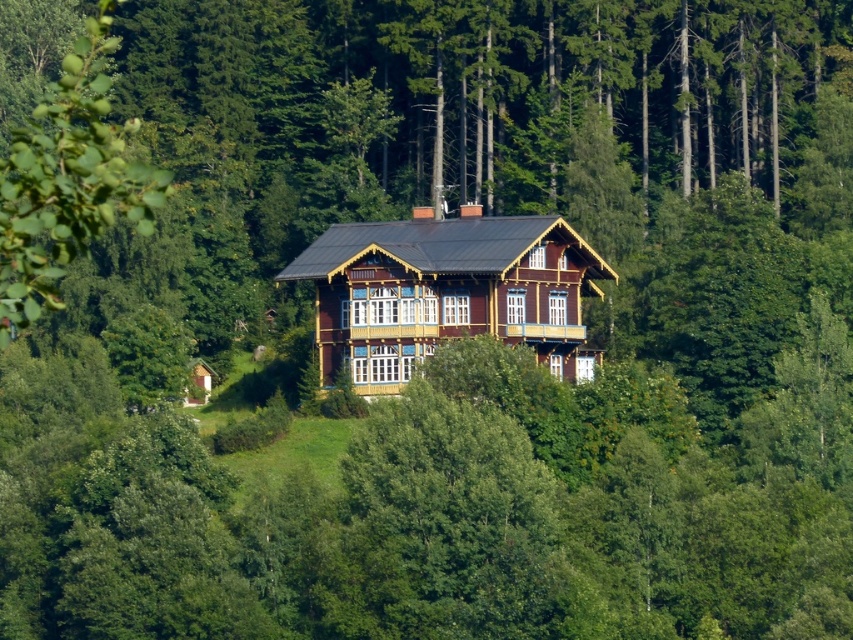
Which is more to the right, wooden cabin at center or green leafy tree at left?

Positioned to the right is wooden cabin at center.

Where is `wooden cabin at center`? The height and width of the screenshot is (640, 853). wooden cabin at center is located at coordinates (445, 291).